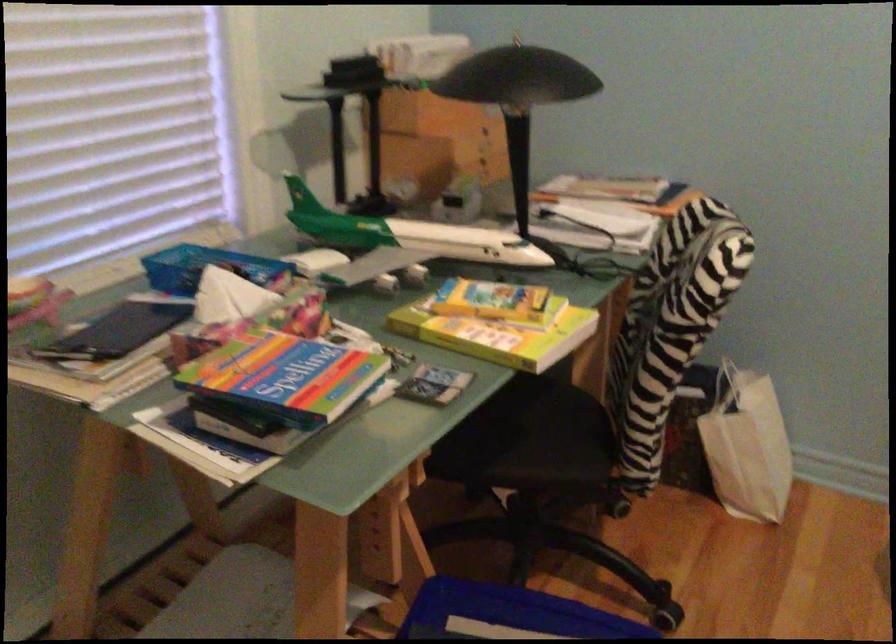
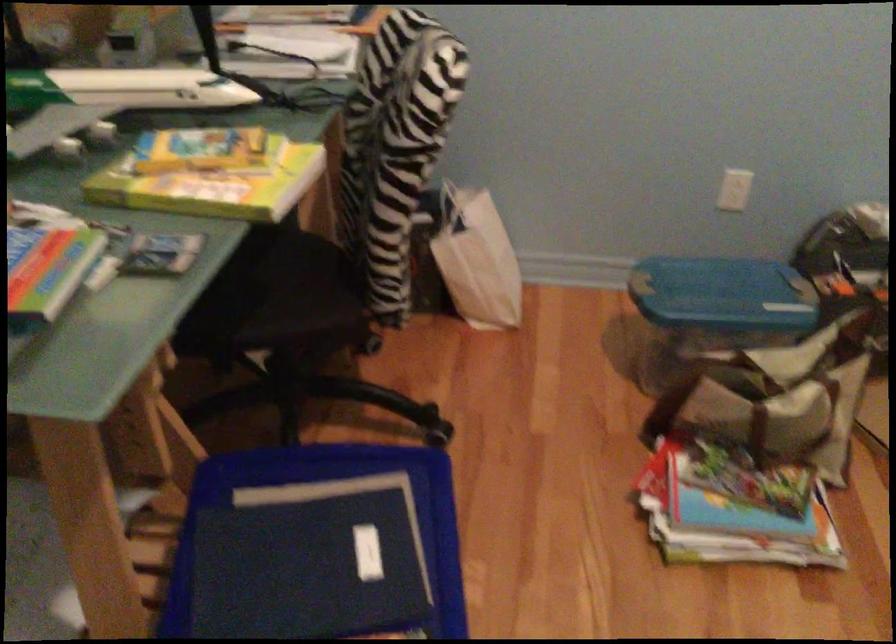
Question: Which direction would the cameraman need to move to produce the second image? Reply with the corresponding letter.

Choices:
 (A) Left
 (B) Right
 (C) Forward
 (D) Backward

Answer: (C)